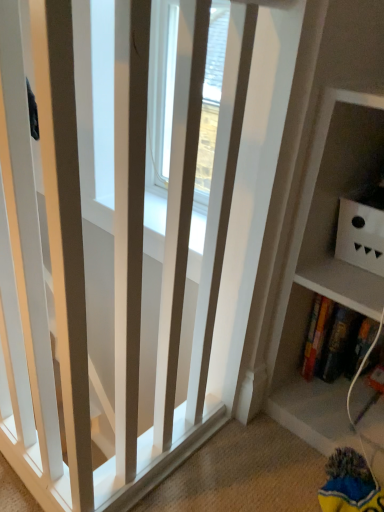
Describe the element at coordinates (335, 340) in the screenshot. This screenshot has width=384, height=512. I see `hardcover book at lower right` at that location.

Where is `hardcover book at lower right`? The height and width of the screenshot is (512, 384). hardcover book at lower right is located at coordinates click(x=335, y=340).

This screenshot has width=384, height=512. In order to click on white matte box at upper right in this screenshot , I will do `click(360, 236)`.

What do you see at coordinates (360, 236) in the screenshot? This screenshot has height=512, width=384. I see `white matte box at upper right` at bounding box center [360, 236].

Identify the location of hardcover book at lower right. (335, 340).

Considering the relative positions of white matte box at upper right and hardcover book at lower right in the image provided, is white matte box at upper right to the left of hardcover book at lower right from the viewer's perspective?

No, white matte box at upper right is not to the left of hardcover book at lower right.

Is white matte box at upper right closer to the viewer compared to hardcover book at lower right?

Yes.

Is point (342, 240) closer to viewer compared to point (316, 322)?

Yes.

From the image's perspective, is white matte box at upper right beneath hardcover book at lower right?

No, from the image's perspective, white matte box at upper right is not beneath hardcover book at lower right.

From a real-world perspective, is white matte box at upper right physically located above or below hardcover book at lower right?

From a real-world perspective, white matte box at upper right is physically above hardcover book at lower right.

Is white matte box at upper right thinner than hardcover book at lower right?

No, white matte box at upper right is not thinner than hardcover book at lower right.

Does white matte box at upper right have a greater height compared to hardcover book at lower right?

No.

Between white matte box at upper right and hardcover book at lower right, which one has larger size?

Bigger between the two is white matte box at upper right.

Would you say white matte box at upper right contains hardcover book at lower right?

No, hardcover book at lower right is not a part of white matte box at upper right.

Is white matte box at upper right not close to hardcover book at lower right?

white matte box at upper right is actually quite close to hardcover book at lower right.

Based on the photo, is white matte box at upper right aimed at hardcover book at lower right?

No, white matte box at upper right is not oriented towards hardcover book at lower right.

How many degrees apart are the facing directions of white matte box at upper right and hardcover book at lower right?

They differ by 4.26 degrees in their facing directions.

Locate an element on the screen. Image resolution: width=384 pixels, height=512 pixels. book that is below the white matte box at upper right (from the image's perspective) is located at coordinates pos(335,340).

Which object is positioned more to the left, hardcover book at lower right or white matte box at upper right?

Positioned to the left is hardcover book at lower right.

Looking at this image, between hardcover book at lower right and white matte box at upper right, which one is positioned in front?

Positioned in front is white matte box at upper right.

Which is farther, (322, 348) or (382, 213)?

The point (322, 348) is more distant.

From the image's perspective, which is below, hardcover book at lower right or white matte box at upper right?

hardcover book at lower right, from the image's perspective.

From a real-world perspective, who is located lower, hardcover book at lower right or white matte box at upper right?

From a 3D spatial view, hardcover book at lower right is below.

Which of these two, hardcover book at lower right or white matte box at upper right, is wider?

white matte box at upper right.

From their relative heights in the image, would you say hardcover book at lower right is taller or shorter than white matte box at upper right?

Considering their sizes, hardcover book at lower right has more height than white matte box at upper right.

Who is bigger, hardcover book at lower right or white matte box at upper right?

white matte box at upper right is bigger.

Is hardcover book at lower right inside the boundaries of white matte box at upper right, or outside?

hardcover book at lower right is spatially situated outside white matte box at upper right.

Is hardcover book at lower right far from white matte box at upper right?

No, hardcover book at lower right is in close proximity to white matte box at upper right.

Is hardcover book at lower right oriented towards white matte box at upper right?

No, hardcover book at lower right is not oriented towards white matte box at upper right.

Measure the distance between hardcover book at lower right and white matte box at upper right.

hardcover book at lower right and white matte box at upper right are 9.69 inches apart from each other.

What are the coordinates of `book below the white matte box at upper right (from the image's perspective)` in the screenshot? It's located at (335, 340).

This screenshot has height=512, width=384. There is a hardcover book at lower right. In order to click on cabinet above it (from a real-world perspective) in this screenshot , I will do `click(360, 236)`.

At what (x,y) coordinates should I click in order to perform the action: click on cabinet in front of the hardcover book at lower right. Please return your answer as a coordinate pair (x, y). The image size is (384, 512). Looking at the image, I should click on (360, 236).